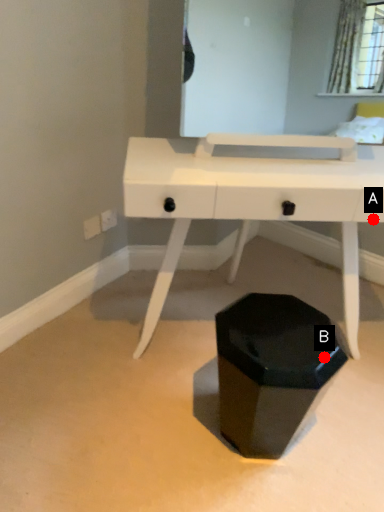
Question: Two points are circled on the image, labeled by A and B beside each circle. Which point appears farthest from the camera in this image?

Choices:
 (A) A is further
 (B) B is further

Answer: (A)